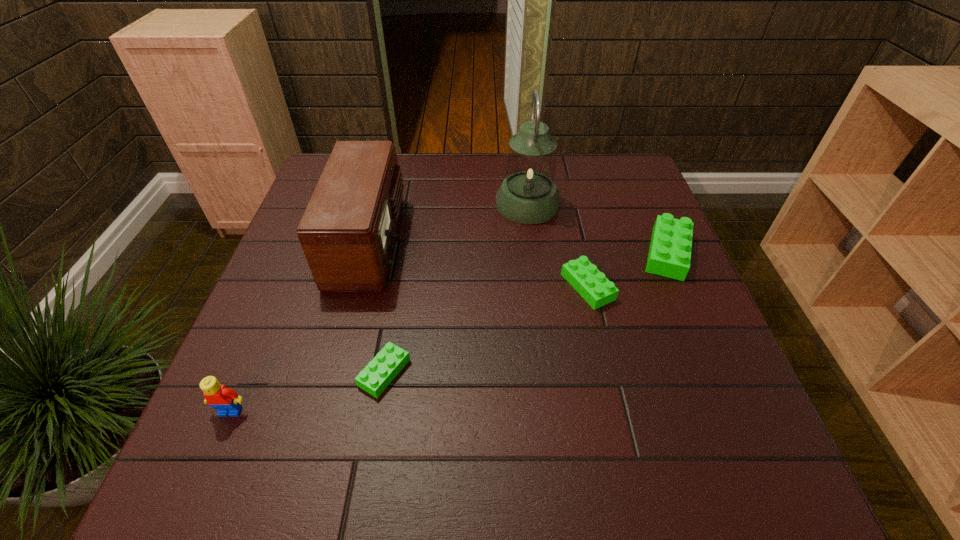
If equal spacing is the goal by inserting an additional Lego among them, please point out a vacant space for this new Lego. Please provide its 2D coordinates. Your answer should be formatted as a tuple, i.e. [(x, y)], where the tuple contains the x and y coordinates of a point satisfying the conditions above.

[(494, 326)]